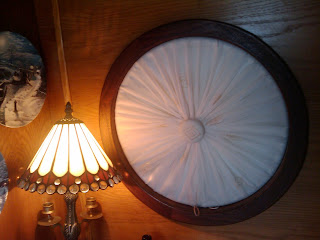
The height and width of the screenshot is (240, 320). Find the location of `light source`. light source is located at coordinates (78, 153).